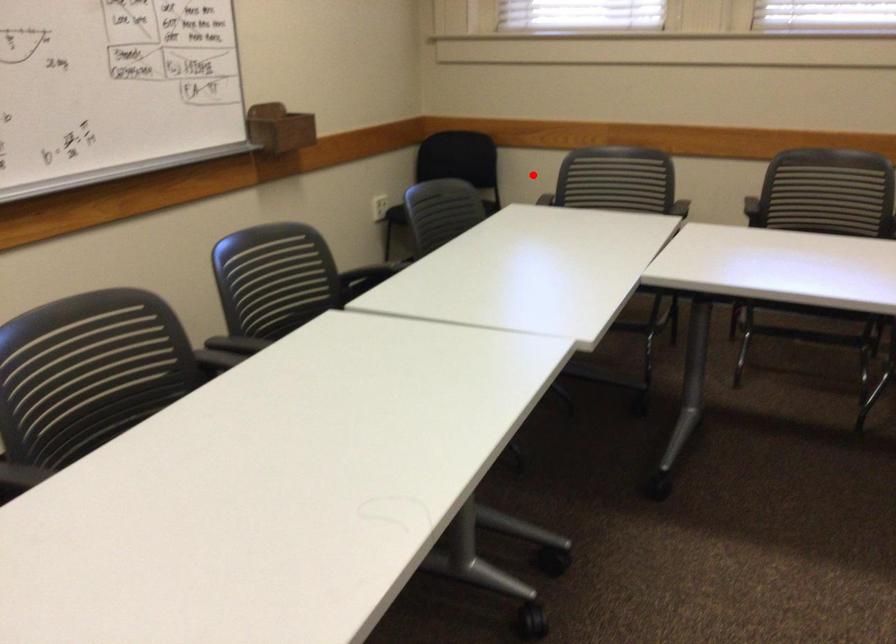
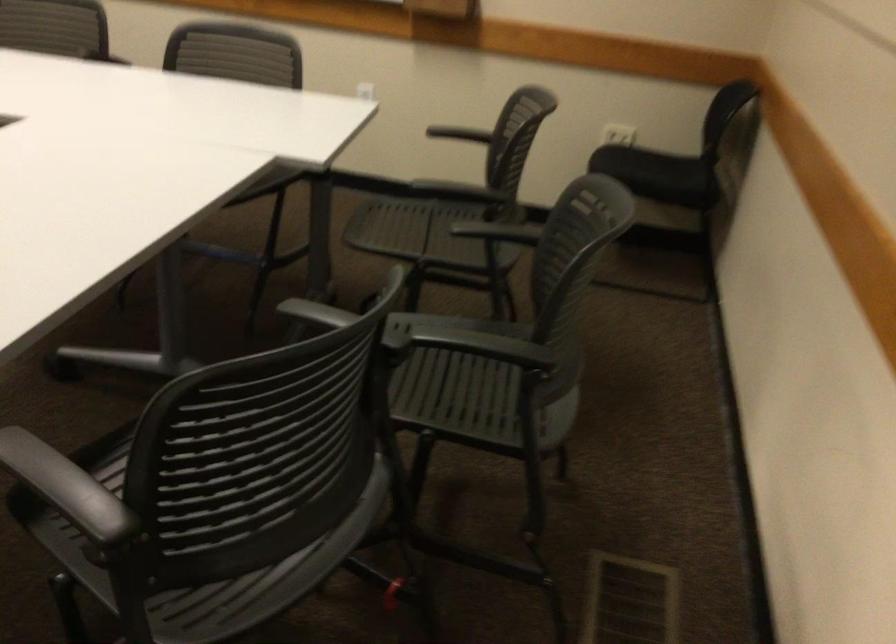
Question: I am providing you with two images of the same scene from different viewpoints. A red point is marked on the first image. Can you still see the location of the red point in image 2?

Choices:
 (A) Yes
 (B) No

Answer: (B)